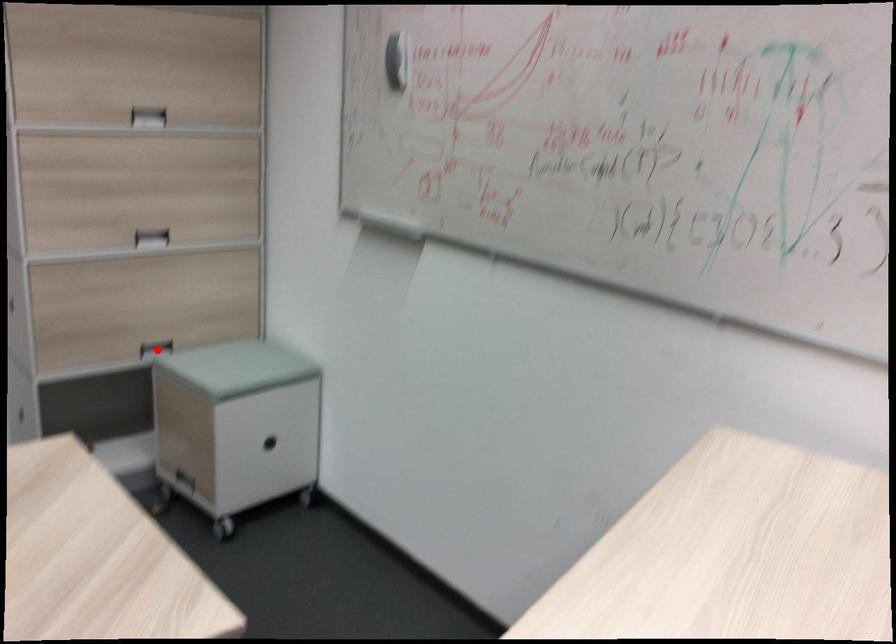
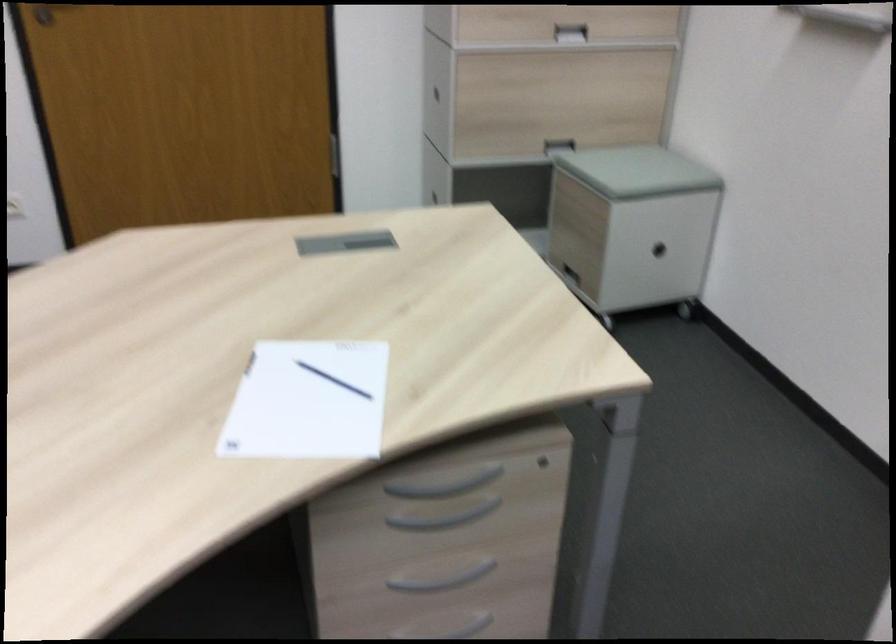
Locate, in the second image, the point that corresponds to the highlighted location in the first image.

(557, 146)